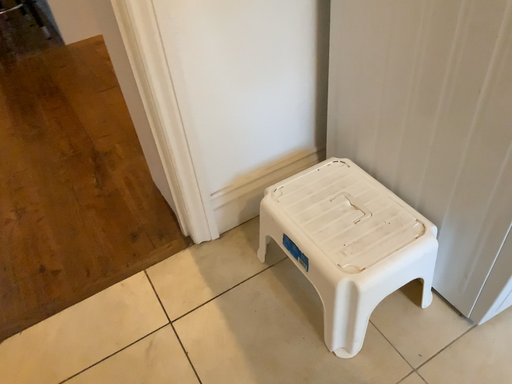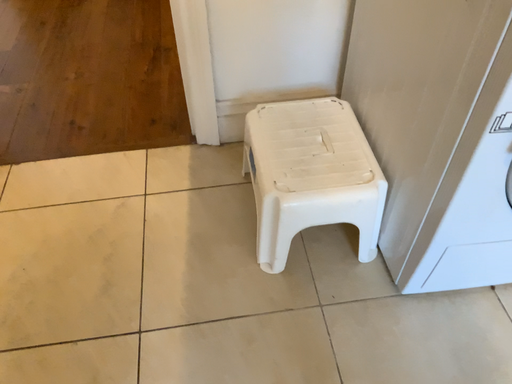
Question: How did the camera likely rotate when shooting the video?

Choices:
 (A) rotated right
 (B) rotated left

Answer: (B)